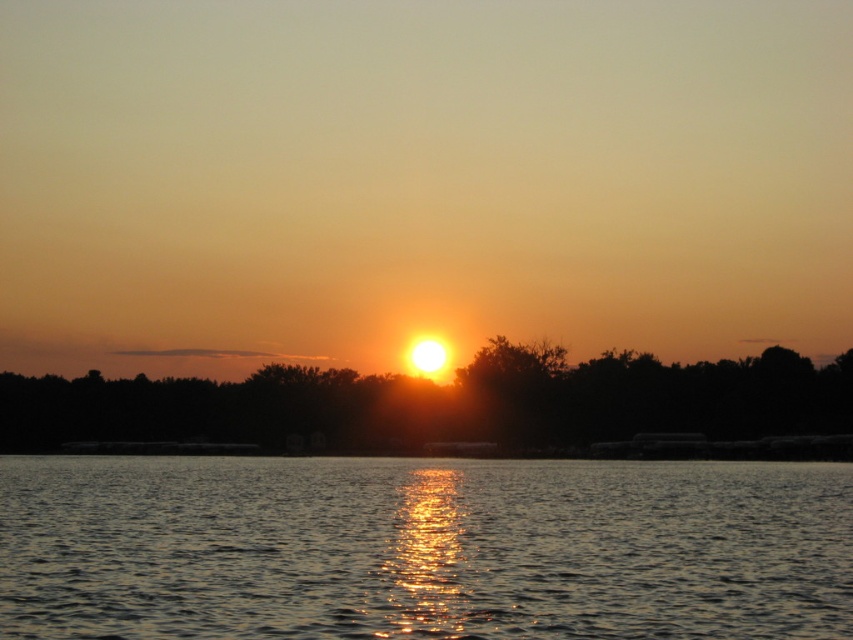
Does glistening water at center appear on the left side of golden reflective water at center?

In fact, glistening water at center is to the right of golden reflective water at center.

What do you see at coordinates (422, 547) in the screenshot? I see `glistening water at center` at bounding box center [422, 547].

Does point (184, 484) lie in front of point (498, 404)?

Yes, point (184, 484) is in front of point (498, 404).

This screenshot has width=853, height=640. Find the location of `glistening water at center`. glistening water at center is located at coordinates (422, 547).